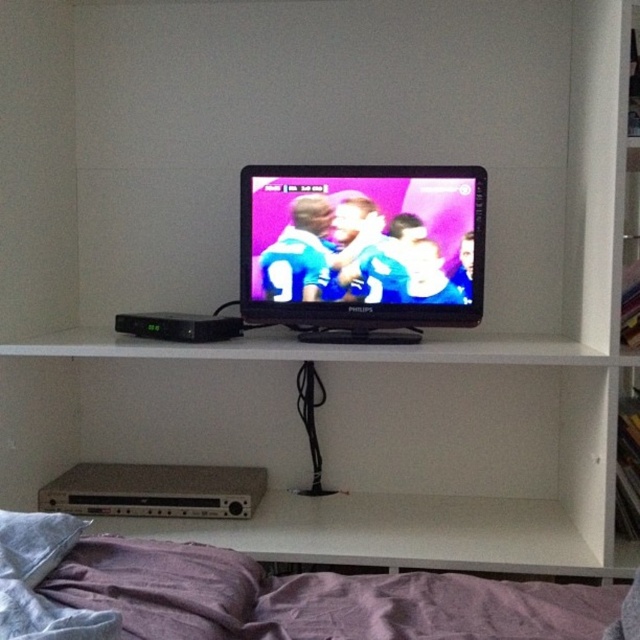
Based on the photo, who is higher up, purple fabric bed at lower center or matte black tv at center?

matte black tv at center

The width and height of the screenshot is (640, 640). Describe the element at coordinates (264, 595) in the screenshot. I see `purple fabric bed at lower center` at that location.

This screenshot has width=640, height=640. In order to click on purple fabric bed at lower center in this screenshot , I will do `click(264, 595)`.